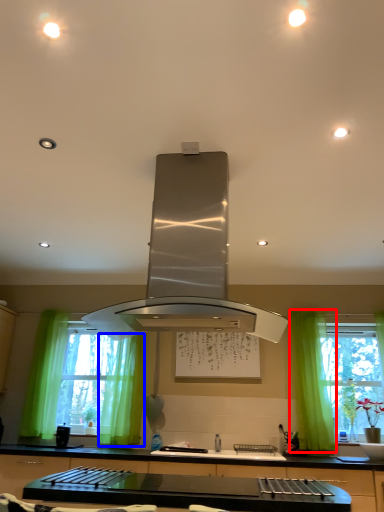
Question: Which point is further to the camera, curtain (highlighted by a red box) or curtain (highlighted by a blue box)?

Choices:
 (A) curtain
 (B) curtain

Answer: (B)